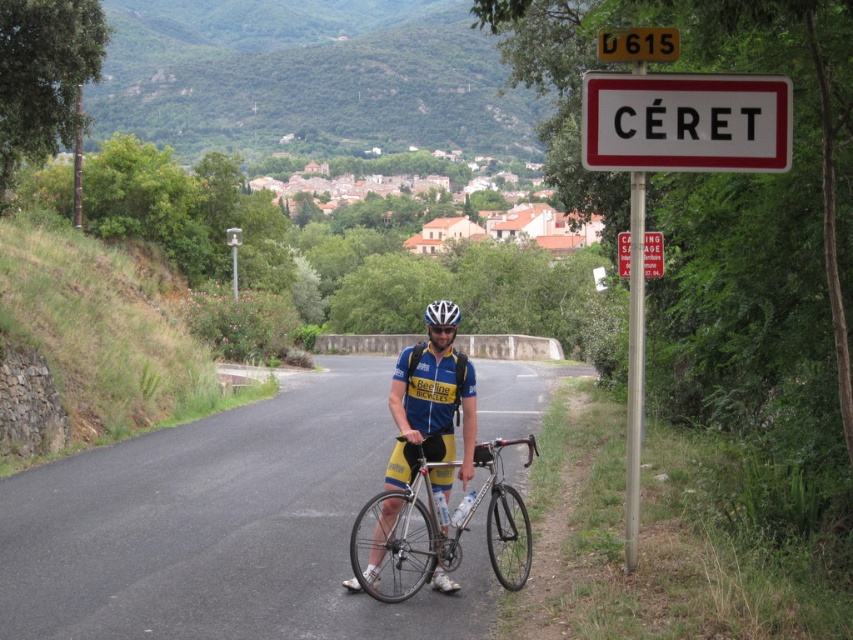
Does metallic silver bicycle at center appear on the left side of silver metallic bicycle at center?

Correct, you'll find metallic silver bicycle at center to the left of silver metallic bicycle at center.

Is point (47, 636) more distant than point (360, 586)?

No, (47, 636) is in front of (360, 586).

Is point (517, 369) closer to camera compared to point (397, 499)?

No, (517, 369) is further to viewer.

Locate an element on the screen. Image resolution: width=853 pixels, height=640 pixels. metallic silver bicycle at center is located at coordinates (222, 529).

Is silver metallic bicycle at center thinner than white matte bicycle helmet at center?

Yes.

Is silver metallic bicycle at center to the left of white matte bicycle helmet at center from the viewer's perspective?

Incorrect, silver metallic bicycle at center is not on the left side of white matte bicycle helmet at center.

Which is behind, point (421, 584) or point (433, 324)?

The point (433, 324) is behind.

This screenshot has width=853, height=640. I want to click on silver metallic bicycle at center, so click(x=450, y=522).

Does metallic silver bicycle at center have a smaller size compared to white matte bicycle helmet at center?

Correct, metallic silver bicycle at center occupies less space than white matte bicycle helmet at center.

Who is shorter, metallic silver bicycle at center or white matte bicycle helmet at center?

metallic silver bicycle at center is shorter.

Does point (82, 483) come closer to viewer compared to point (454, 314)?

No, (82, 483) is further to viewer.

Locate an element on the screen. metallic silver bicycle at center is located at coordinates (222, 529).